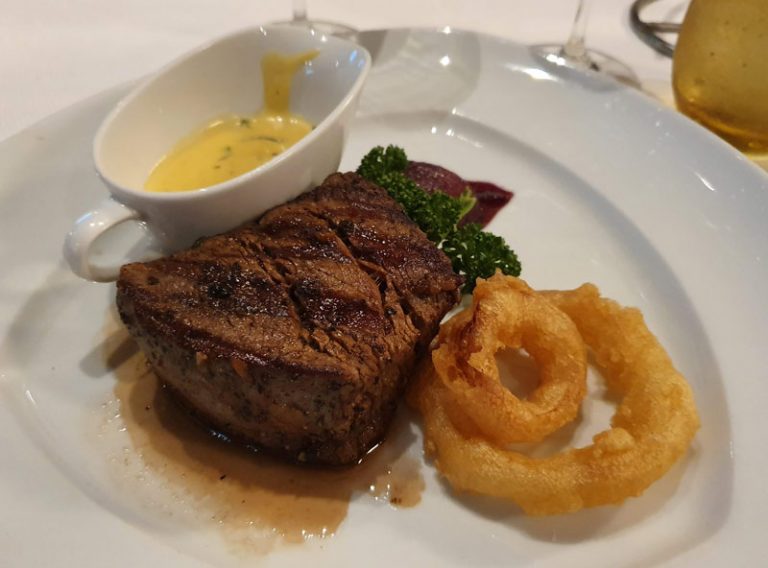
At what (x,y) coordinates should I click in order to perform the action: click on yellow cup. Please return your answer as a coordinate pair (x, y). The height and width of the screenshot is (568, 768). Looking at the image, I should click on (710, 61).